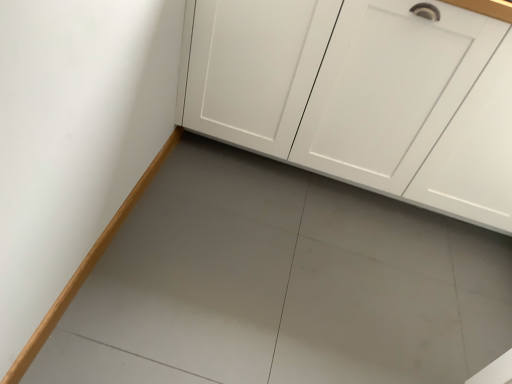
What do you see at coordinates (361, 95) in the screenshot? I see `white matte cabinet at center` at bounding box center [361, 95].

Find the location of a particular element. The image size is (512, 384). white matte cabinet at center is located at coordinates (361, 95).

The image size is (512, 384). I want to click on white matte cabinet at center, so click(x=361, y=95).